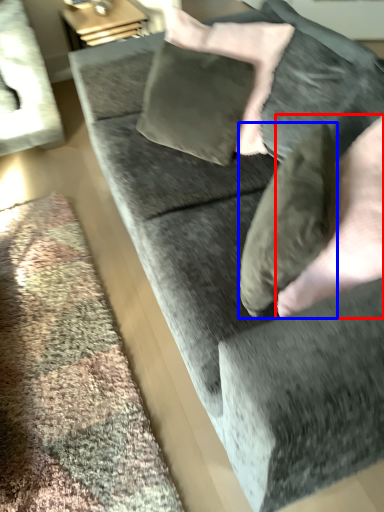
Question: Which object is further to the camera taking this photo, hand (highlighted by a red box) or pillow (highlighted by a blue box)?

Choices:
 (A) hand
 (B) pillow

Answer: (B)